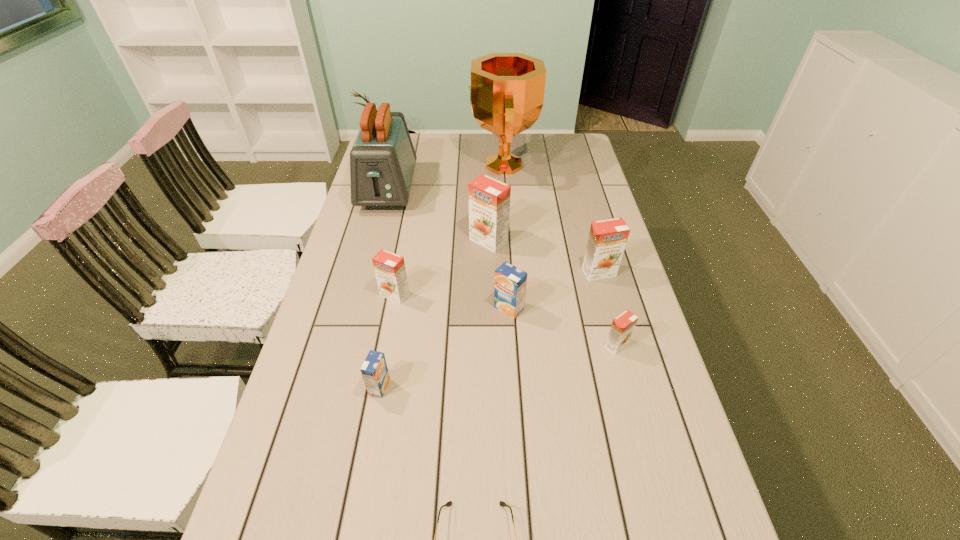
Locate an element on the screen. The height and width of the screenshot is (540, 960). gold award is located at coordinates (506, 95).

I want to click on award, so click(506, 95).

At what (x,y) coordinates should I click in order to perform the action: click on the eighth shortest object. Please return your answer as a coordinate pair (x, y). Looking at the image, I should click on (382, 160).

You are a GUI agent. You are given a task and a screenshot of the screen. Output one action in this format:
    pyautogui.click(x=<x>, y=<y>)
    Task: Click on the farthest orange orange juice
    This screenshot has width=960, height=540.
    Given the screenshot: What is the action you would take?
    pyautogui.click(x=489, y=199)

Image resolution: width=960 pixels, height=540 pixels. Find the location of `the second orange orange juice from left to right`. the second orange orange juice from left to right is located at coordinates pos(489,199).

Where is `the third smallest orange orange juice`? the third smallest orange orange juice is located at coordinates (607, 239).

Where is `the second farthest orange juice`? the second farthest orange juice is located at coordinates (607, 239).

At what (x,y) coordinates should I click in order to perform the action: click on the leftmost orange orange juice. Please return your answer as a coordinate pair (x, y). The width and height of the screenshot is (960, 540). Looking at the image, I should click on (389, 268).

Locate an element on the screen. the third biggest orange orange juice is located at coordinates (389, 268).

Locate an element on the screen. the farther blue orange_juice is located at coordinates (510, 282).